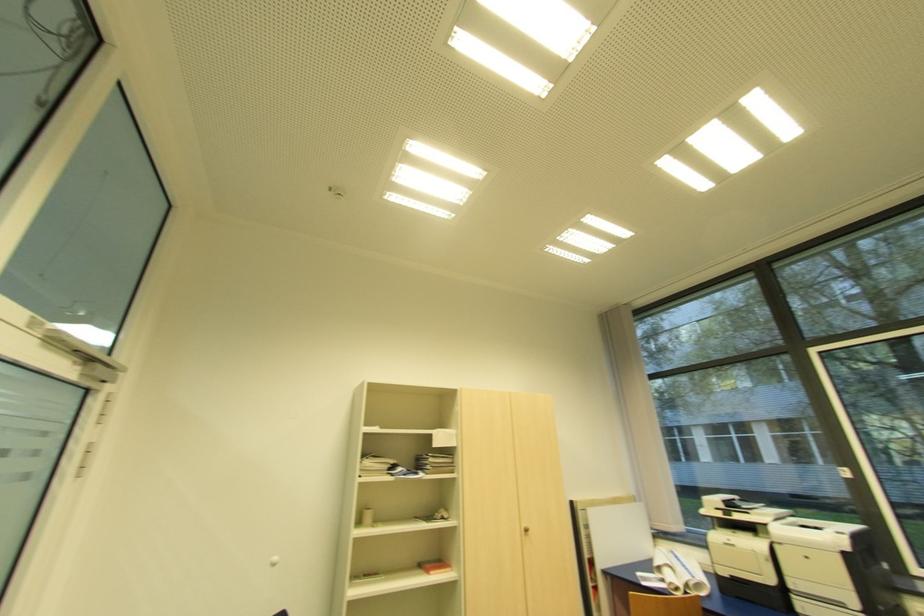
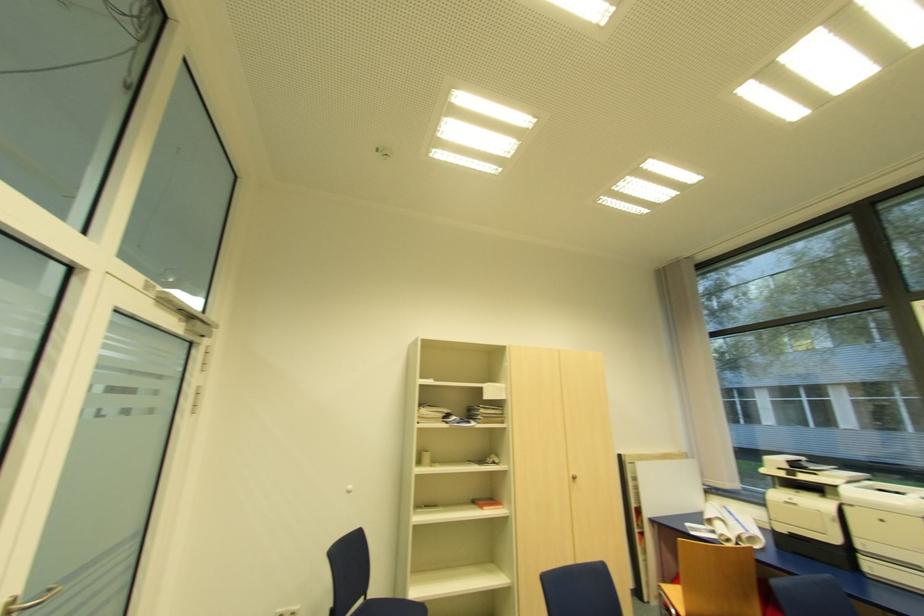
Where in the second image is the point corresponding to point 529,531 from the first image?

(576, 477)